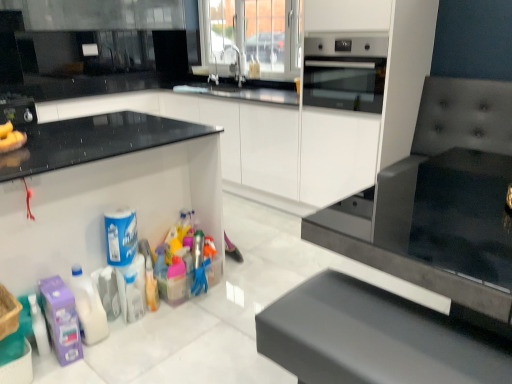
Question: Is white glossy cabinet at center, which is the 2th cabinetry in front-to-back order, turned away from purple matte cleaning product at lower left, which appears as the first cleaning product when viewed from the left?

Choices:
 (A) yes
 (B) no

Answer: (B)

Question: Is white glossy cabinet at center, which is the 2th cabinetry in front-to-back order, taller than purple matte cleaning product at lower left, which appears as the first cleaning product when viewed from the left?

Choices:
 (A) no
 (B) yes

Answer: (B)

Question: Can you confirm if white glossy cabinet at center, which ranks as the first cabinetry in back-to-front order, is positioned to the right of purple matte cleaning product at lower left, which appears as the first cleaning product when viewed from the left?

Choices:
 (A) yes
 (B) no

Answer: (A)

Question: Is white glossy cabinet at center, which ranks as the first cabinetry in back-to-front order, thinner than purple matte cleaning product at lower left, which appears as the first cleaning product when viewed from the left?

Choices:
 (A) yes
 (B) no

Answer: (B)

Question: Is white glossy cabinet at center, which ranks as the first cabinetry in back-to-front order, facing towards purple matte cleaning product at lower left, which appears as the first cleaning product when viewed from the left?

Choices:
 (A) no
 (B) yes

Answer: (B)

Question: Considering their positions, is purple matte cleaning product at lower left, which is the 4th cleaning product from right to left, located in front of or behind stainless steel oven at upper right?

Choices:
 (A) behind
 (B) front

Answer: (B)

Question: In terms of width, does purple matte cleaning product at lower left, which appears as the first cleaning product when viewed from the left, look wider or thinner when compared to stainless steel oven at upper right?

Choices:
 (A) wide
 (B) thin

Answer: (B)

Question: Considering the positions of purple matte cleaning product at lower left, which is the 4th cleaning product from right to left, and stainless steel oven at upper right in the image, is purple matte cleaning product at lower left, which is the 4th cleaning product from right to left, taller or shorter than stainless steel oven at upper right?

Choices:
 (A) short
 (B) tall

Answer: (A)

Question: From the image's perspective, is purple matte cleaning product at lower left, which appears as the first cleaning product when viewed from the left, above or below stainless steel oven at upper right?

Choices:
 (A) below
 (B) above

Answer: (A)

Question: From their relative heights in the image, would you say brushed metal toaster at left is taller or shorter than white plastic container at lower left, marked as the first cabinetry in a front-to-back arrangement?

Choices:
 (A) short
 (B) tall

Answer: (A)

Question: From a real-world perspective, is brushed metal toaster at left above or below white plastic container at lower left, the 2th cabinetry positioned from the back?

Choices:
 (A) below
 (B) above

Answer: (B)

Question: Is brushed metal toaster at left wider or thinner than white plastic container at lower left, marked as the first cabinetry in a front-to-back arrangement?

Choices:
 (A) wide
 (B) thin

Answer: (B)

Question: From the image's perspective, is brushed metal toaster at left positioned above or below white plastic container at lower left, the 2th cabinetry positioned from the back?

Choices:
 (A) above
 (B) below

Answer: (A)

Question: From a real-world perspective, is brushed metal toaster at left physically located above or below translucent plastic bottle at lower left?

Choices:
 (A) above
 (B) below

Answer: (A)

Question: From the image's perspective, relative to translucent plastic bottle at lower left, is brushed metal toaster at left above or below?

Choices:
 (A) below
 (B) above

Answer: (B)